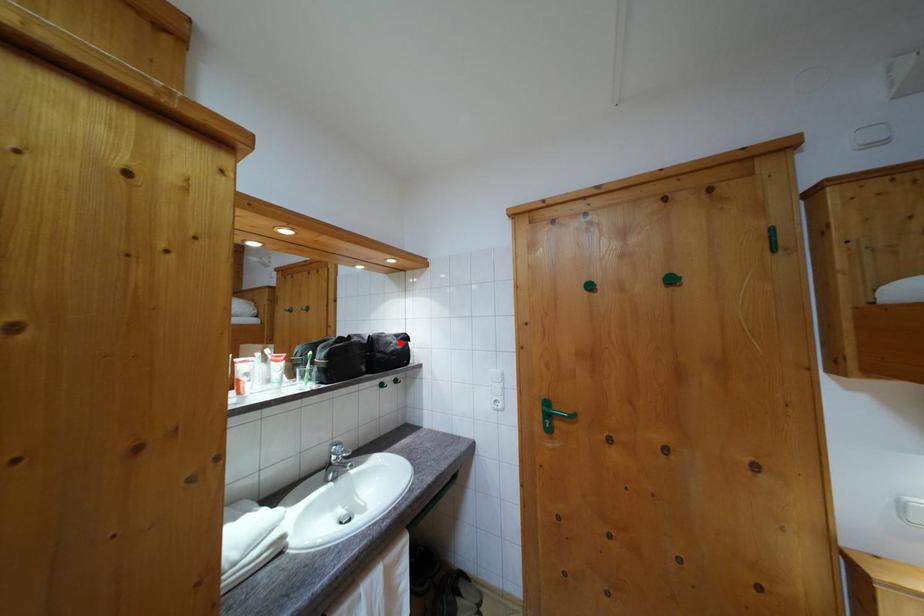
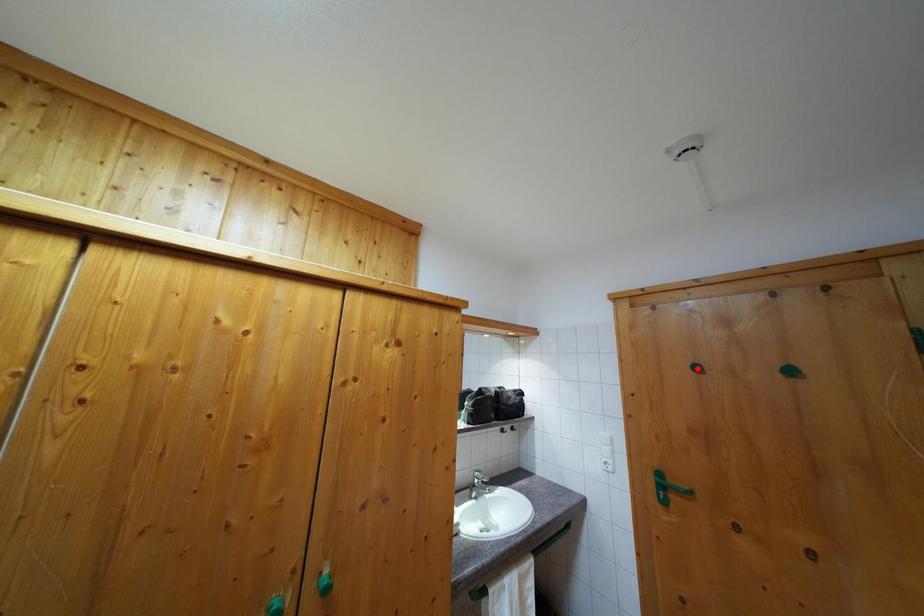
I am providing you with two images of the same scene from different viewpoints. A red point is marked on the first image and another point is marked on the second image. Is the marked point in image1 the same physical position as the marked point in image2?

No